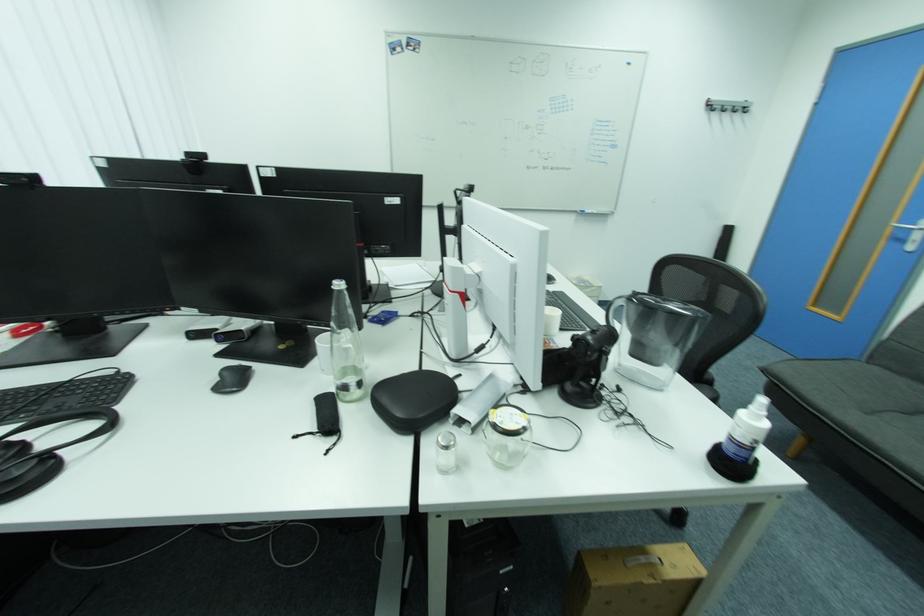
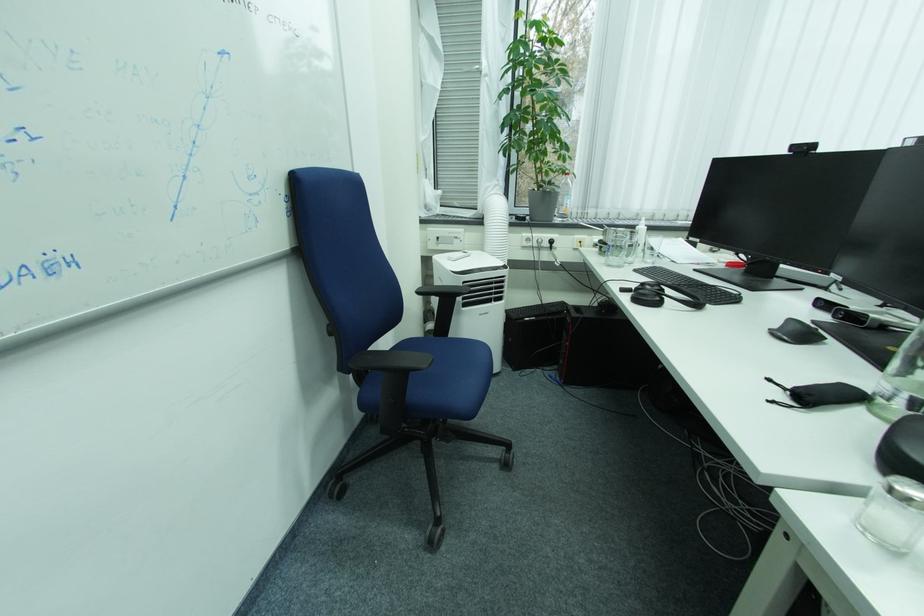
In the second image, find the point that corresponds to [300,440] in the first image.

(773, 383)